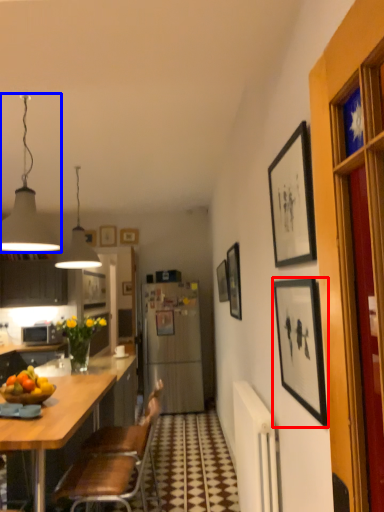
Question: Which point is closer to the camera, picture frame (highlighted by a red box) or lamp (highlighted by a blue box)?

Choices:
 (A) picture frame
 (B) lamp

Answer: (A)